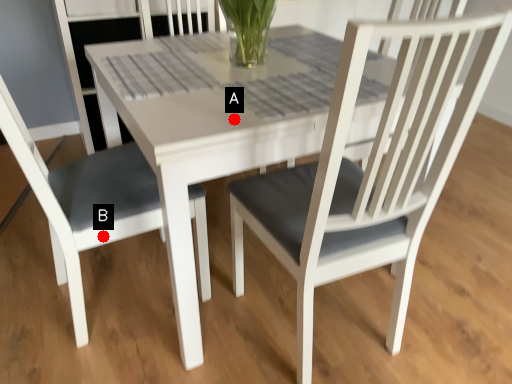
Question: Two points are circled on the image, labeled by A and B beside each circle. Among these points, which one is farthest from the camera?

Choices:
 (A) A is further
 (B) B is further

Answer: (B)